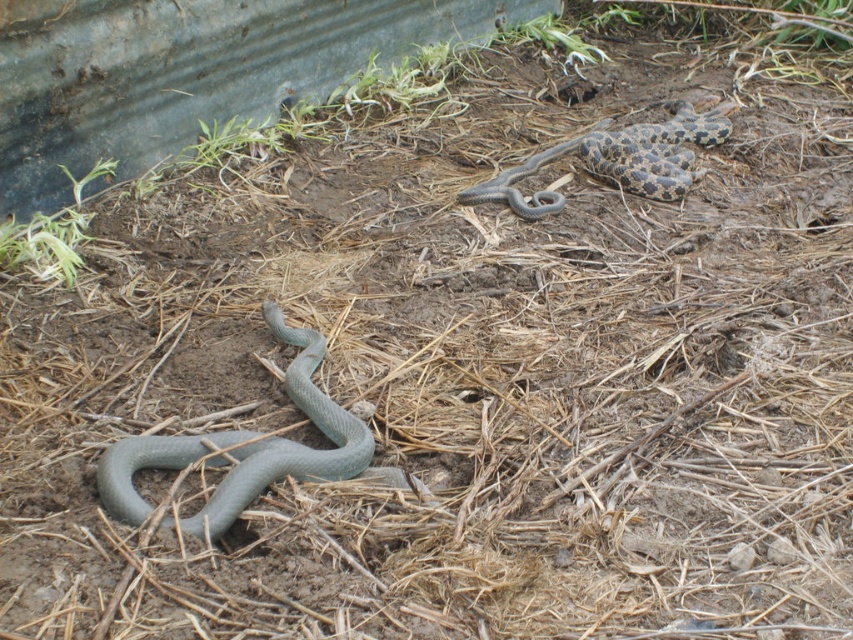
At what (x,y) coordinates should I click in order to perform the action: click on matte gray snake at lower left. Please return your answer as a coordinate pair (x, y). The height and width of the screenshot is (640, 853). Looking at the image, I should click on (242, 449).

Between matte gray snake at lower left and speckled gray snake at upper right, which one is positioned higher?

speckled gray snake at upper right is higher up.

Is point (238, 492) behind point (680, 104)?

No, it is in front of (680, 104).

Image resolution: width=853 pixels, height=640 pixels. Identify the location of matte gray snake at lower left. (242, 449).